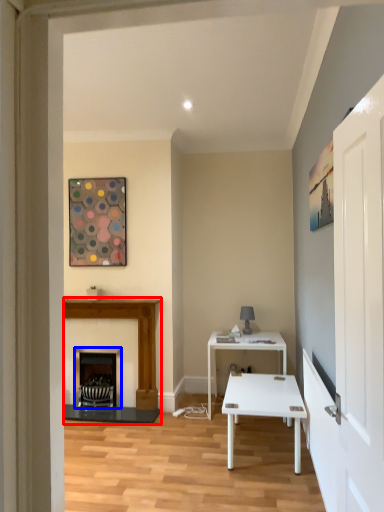
Question: Which of the following is the farthest to the observer, fireplace (highlighted by a red box) or fireplace (highlighted by a blue box)?

Choices:
 (A) fireplace
 (B) fireplace

Answer: (B)